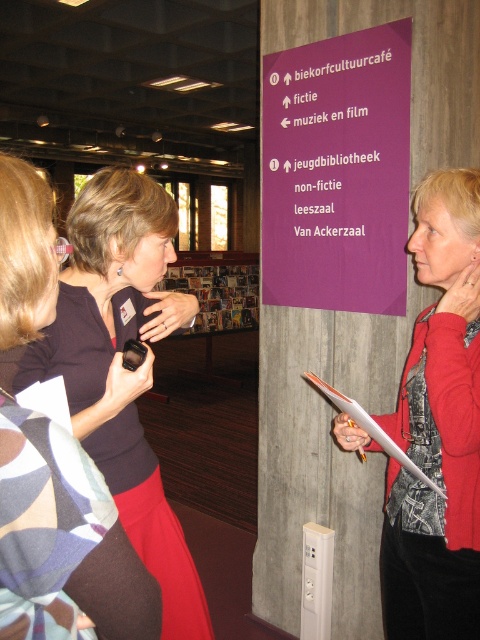
Question: Is matte black phone at center below white paper clipboard at right?

Choices:
 (A) no
 (B) yes

Answer: (B)

Question: Which object appears farthest from the camera in this image?

Choices:
 (A) white paper clipboard at right
 (B) red matte jacket at center

Answer: (A)

Question: Which point is farther to the camera?

Choices:
 (A) (421, 237)
 (B) (136, 467)

Answer: (B)

Question: Which point is farther from the camera taking this photo?

Choices:
 (A) (405, 468)
 (B) (447, 627)
 (C) (184, 604)

Answer: (C)

Question: Is red matte jacket at center below white paper clipboard at right?

Choices:
 (A) no
 (B) yes

Answer: (B)

Question: Can you confirm if red matte jacket at center is positioned below white paper clipboard at right?

Choices:
 (A) no
 (B) yes

Answer: (B)